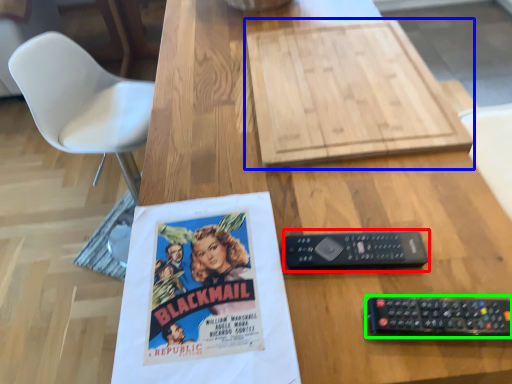
Question: Estimate the real-world distances between objects in this image. Which object is closer to control (highlighted by a red box), cardboard (highlighted by a blue box) or remote control (highlighted by a green box)?

Choices:
 (A) cardboard
 (B) remote control

Answer: (B)